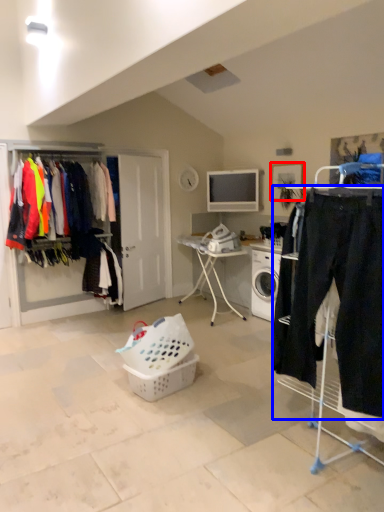
Question: Which object appears closest to the camera in this image, picture frame (highlighted by a red box) or clothing (highlighted by a blue box)?

Choices:
 (A) picture frame
 (B) clothing

Answer: (B)